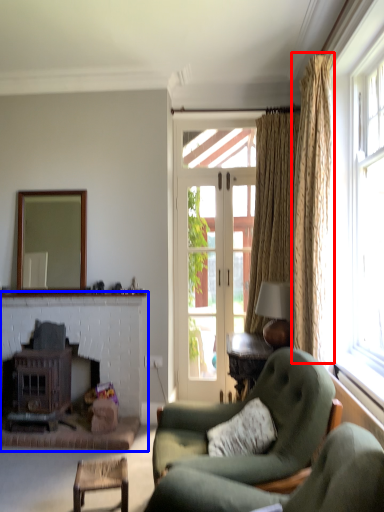
Question: Which of the following is the closest to the observer, curtain (highlighted by a red box) or fireplace (highlighted by a blue box)?

Choices:
 (A) curtain
 (B) fireplace

Answer: (A)